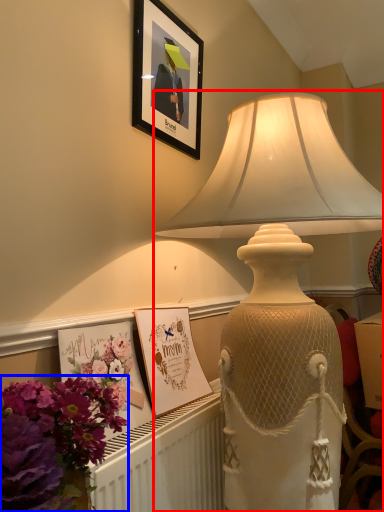
Question: Which of the following is the closest to the observer, lamp (highlighted by a red box) or flower (highlighted by a blue box)?

Choices:
 (A) lamp
 (B) flower

Answer: (B)